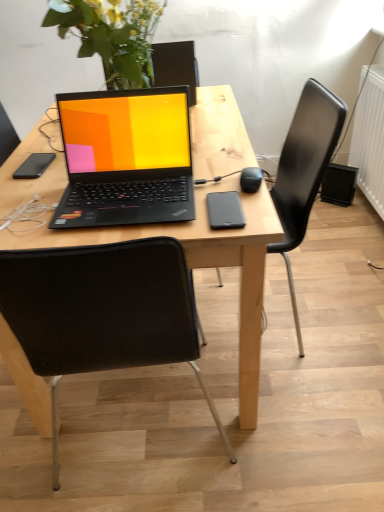
This screenshot has height=512, width=384. What are the coordinates of `vacant area that lies in front of black matte computer mouse at center-right` in the screenshot? It's located at (244, 214).